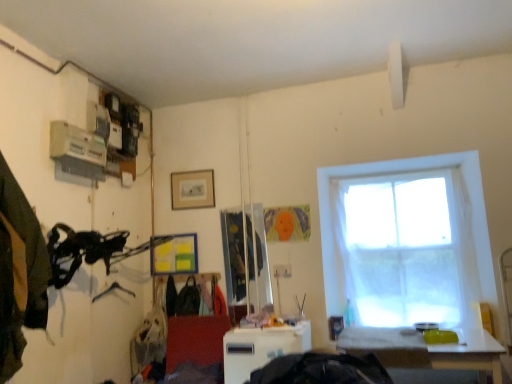
This screenshot has width=512, height=384. Identify the location of dark green fabric at left, which is the 1th clothing from left to right. (19, 273).

What do you see at coordinates (425, 349) in the screenshot?
I see `white glossy table at lower right, which is the second table in left-to-right order` at bounding box center [425, 349].

Image resolution: width=512 pixels, height=384 pixels. What do you see at coordinates (188, 299) in the screenshot?
I see `matte black backpack at center, acting as the second clothing starting from the back` at bounding box center [188, 299].

Locate an element on the screen. The height and width of the screenshot is (384, 512). matte wood picture frame at upper center is located at coordinates (192, 189).

Locate an element on the screen. dark green fabric at left, the 3th clothing positioned from the right is located at coordinates (19, 273).

From the image's perspective, between matte wood picture frame at upper center and white plastic table at center, the second table from the right, which one is located above?

matte wood picture frame at upper center appears higher in the image.

Does matte wood picture frame at upper center have a lesser width compared to white plastic table at center, the second table from the right?

Correct, the width of matte wood picture frame at upper center is less than that of white plastic table at center, the second table from the right.

Which object is positioned more to the left, matte wood picture frame at upper center or white plastic table at center, arranged as the first table when viewed from the left?

matte wood picture frame at upper center.

In the scene shown: From a real-world perspective, who is located higher, matte wood picture frame at upper center or white plastic table at center, the second table from the right?

matte wood picture frame at upper center, from a real-world perspective.

Consider the image. Do you think white glossy table at lower right, which is the second table in left-to-right order, is within metallic silver hanger at lower left, or outside of it?

white glossy table at lower right, which is the second table in left-to-right order, is not inside metallic silver hanger at lower left, it's outside.

Is white glossy table at lower right, which is the second table in left-to-right order, positioned before metallic silver hanger at lower left?

That is True.

From a real-world perspective, starting from the metallic silver hanger at lower left, which table is the 2nd one below it? Please provide its 2D coordinates.

[(425, 349)]

Is white glossy table at lower right, marked as the 1th table in a right-to-left arrangement, far from metallic silver hanger at lower left?

Absolutely, white glossy table at lower right, marked as the 1th table in a right-to-left arrangement, is distant from metallic silver hanger at lower left.

Considering the sizes of objects black fabric bag at center, the second clothing from the right, and white plastic table at center, the second table from the right, in the image provided, who is thinner, black fabric bag at center, the second clothing from the right, or white plastic table at center, the second table from the right,?

Thinner between the two is black fabric bag at center, the second clothing from the right.

At what (x,y) coordinates should I click in order to perform the action: click on the 2nd clothing behind the white plastic table at center, arranged as the first table when viewed from the left, counting from the anchor's position. Please return your answer as a coordinate pair (x, y). Looking at the image, I should click on [170, 296].

From the picture: Which object is further away from the camera taking this photo, black fabric bag at center, the 3th clothing in the front-to-back sequence, or white plastic table at center, arranged as the first table when viewed from the left?

black fabric bag at center, the 3th clothing in the front-to-back sequence, is further from the camera.

Is black fabric bag at center, which is counted as the 2th clothing, starting from the left, positioned with its back to white plastic table at center, the second table from the right?

No, black fabric bag at center, which is counted as the 2th clothing, starting from the left,'s orientation is not away from white plastic table at center, the second table from the right.

From the image's perspective, is white plastic table at center, the second table from the right, below white sheer curtain at right?

Yes.

Between white plastic table at center, the second table from the right, and white sheer curtain at right, which one has smaller width?

white sheer curtain at right is thinner.

What are the coordinates of `window above the white plastic table at center, the second table from the right (from a real-world perspective)` in the screenshot? It's located at (399, 172).

Is white plastic table at center, arranged as the first table when viewed from the left, to the left of white sheer curtain at right from the viewer's perspective?

Indeed, white plastic table at center, arranged as the first table when viewed from the left, is positioned on the left side of white sheer curtain at right.

Could you measure the distance between white plastic table at center, arranged as the first table when viewed from the left, and white glossy table at lower right, which is the second table in left-to-right order?

white plastic table at center, arranged as the first table when viewed from the left, and white glossy table at lower right, which is the second table in left-to-right order, are 23.61 inches apart.

Looking at this image, would you say white plastic table at center, the second table from the right, is outside white glossy table at lower right, marked as the 1th table in a right-to-left arrangement?

That's correct, white plastic table at center, the second table from the right, is outside of white glossy table at lower right, marked as the 1th table in a right-to-left arrangement.

From a real-world perspective, relative to white glossy table at lower right, marked as the 1th table in a right-to-left arrangement, is white plastic table at center, the second table from the right, vertically above or below?

Clearly, from a real-world perspective, white plastic table at center, the second table from the right, is above white glossy table at lower right, marked as the 1th table in a right-to-left arrangement.

Can you confirm if white plastic table at center, the second table from the right, is positioned to the left of white glossy table at lower right, marked as the 1th table in a right-to-left arrangement?

Yes, white plastic table at center, the second table from the right, is to the left of white glossy table at lower right, marked as the 1th table in a right-to-left arrangement.

Is white sheer curtain at right aimed at dark green fabric at left, the 3th clothing positioned from the right?

No, white sheer curtain at right does not turn towards dark green fabric at left, the 3th clothing positioned from the right.

Which is further, (330, 277) or (32, 257)?

Point (330, 277)

From the image's perspective, is white sheer curtain at right located above or below dark green fabric at left, positioned as the 3th clothing in back-to-front order?

Clearly, from the image's perspective, white sheer curtain at right is below dark green fabric at left, positioned as the 3th clothing in back-to-front order.

Does white sheer curtain at right lie behind dark green fabric at left, marked as the first clothing in a front-to-back arrangement?

Yes, white sheer curtain at right is behind dark green fabric at left, marked as the first clothing in a front-to-back arrangement.

Would you say matte black backpack at center, which appears as the 1th clothing when viewed from the right, is outside white plastic table at center, the second table from the right?

Absolutely, matte black backpack at center, which appears as the 1th clothing when viewed from the right, is external to white plastic table at center, the second table from the right.

From a real-world perspective, is matte black backpack at center, which appears as the second clothing when viewed from the front, located higher than white plastic table at center, the second table from the right?

Yes, from a real-world perspective, matte black backpack at center, which appears as the second clothing when viewed from the front, is on top of white plastic table at center, the second table from the right.

Is matte black backpack at center, which appears as the second clothing when viewed from the front, beside white plastic table at center, arranged as the first table when viewed from the left?

No, matte black backpack at center, which appears as the second clothing when viewed from the front, is not beside white plastic table at center, arranged as the first table when viewed from the left.

The height and width of the screenshot is (384, 512). Identify the location of table that is the 1st one when counting rightward from the matte wood picture frame at upper center. (261, 348).

Find the location of `hanger behind the white glossy table at lower right, which is the second table in left-to-right order`. hanger behind the white glossy table at lower right, which is the second table in left-to-right order is located at coordinates (112, 290).

Based on their spatial positions, is white sheer curtain at right or matte wood picture frame at upper center closer to metallic silver hanger at lower left?

Among the two, matte wood picture frame at upper center is located nearer to metallic silver hanger at lower left.

Looking at the image, which one is located further to white sheer curtain at right, white glossy table at lower right, which is the second table in left-to-right order, or dark green fabric at left, the 3th clothing positioned from the right?

dark green fabric at left, the 3th clothing positioned from the right, is positioned further to the anchor white sheer curtain at right.

From the image, which object appears to be nearer to white glossy table at lower right, marked as the 1th table in a right-to-left arrangement, matte black backpack at center, which appears as the second clothing when viewed from the front, or white plastic table at center, the second table from the right?

white plastic table at center, the second table from the right, is closer to white glossy table at lower right, marked as the 1th table in a right-to-left arrangement.

Estimate the real-world distances between objects in this image. Which object is closer to white glossy table at lower right, marked as the 1th table in a right-to-left arrangement, matte wood picture frame at upper center or matte black backpack at center, arranged as the 3th clothing when viewed from the left?

matte black backpack at center, arranged as the 3th clothing when viewed from the left, is closer to white glossy table at lower right, marked as the 1th table in a right-to-left arrangement.

Estimate the real-world distances between objects in this image. Which object is further from dark green fabric at left, which is the 1th clothing from left to right, matte black backpack at center, arranged as the 3th clothing when viewed from the left, or white glossy table at lower right, which is the second table in left-to-right order?

Based on the image, white glossy table at lower right, which is the second table in left-to-right order, appears to be further to dark green fabric at left, which is the 1th clothing from left to right.

Which object lies nearer to the anchor point white glossy table at lower right, marked as the 1th table in a right-to-left arrangement, metallic silver hanger at lower left or dark green fabric at left, the 3th clothing positioned from the right?

dark green fabric at left, the 3th clothing positioned from the right, is closer to white glossy table at lower right, marked as the 1th table in a right-to-left arrangement.

Looking at this image, which object lies further to the anchor point metallic silver hanger at lower left, dark green fabric at left, the 3th clothing positioned from the right, or white sheer curtain at right?

Among the two, white sheer curtain at right is located further to metallic silver hanger at lower left.

Estimate the real-world distances between objects in this image. Which object is further from matte black backpack at center, arranged as the 3th clothing when viewed from the left, matte wood picture frame at upper center or black fabric bag at center, the 3th clothing in the front-to-back sequence?

The object further to matte black backpack at center, arranged as the 3th clothing when viewed from the left, is matte wood picture frame at upper center.

At what (x,y) coordinates should I click in order to perform the action: click on table located between black fabric bag at center, which is counted as the 2th clothing, starting from the left, and white glossy table at lower right, which is the second table in left-to-right order, in the left-right direction. Please return your answer as a coordinate pair (x, y). The width and height of the screenshot is (512, 384). Looking at the image, I should click on (261, 348).

The height and width of the screenshot is (384, 512). I want to click on table between metallic silver hanger at lower left and white glossy table at lower right, which is the second table in left-to-right order, from left to right, so click(261, 348).

I want to click on hanger positioned between dark green fabric at left, positioned as the 3th clothing in back-to-front order, and matte black backpack at center, which appears as the second clothing when viewed from the front, from near to far, so click(112, 290).

In order to click on clothing between dark green fabric at left, the 3th clothing positioned from the right, and black fabric bag at center, the 3th clothing in the front-to-back sequence, from front to back in this screenshot , I will do `click(188, 299)`.